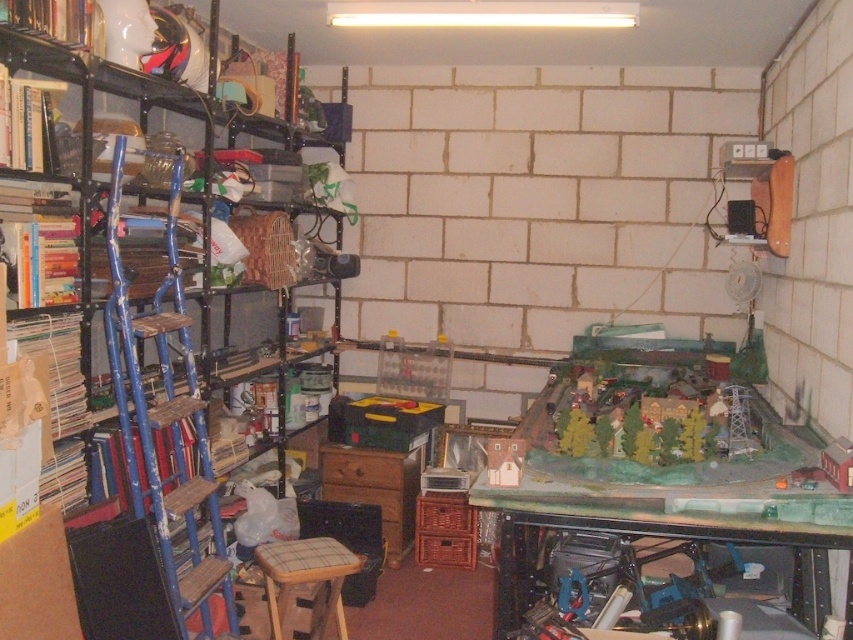
What do you see at coordinates (138, 396) in the screenshot? I see `metallic blue ladder at left` at bounding box center [138, 396].

Between metallic blue ladder at left and wooden stool at center, which one has more height?

With more height is metallic blue ladder at left.

What do you see at coordinates (138, 396) in the screenshot? This screenshot has height=640, width=853. I see `metallic blue ladder at left` at bounding box center [138, 396].

Locate an element on the screen. Image resolution: width=853 pixels, height=640 pixels. metallic blue ladder at left is located at coordinates (138, 396).

Who is taller, green matte table at center or metallic blue ladder at left?

metallic blue ladder at left

Is point (527, 513) closer to camera compared to point (115, 321)?

Yes.

Find the location of a particular element. The image size is (853, 640). green matte table at center is located at coordinates (664, 522).

Which is more to the right, green matte table at center or wooden stool at center?

Positioned to the right is green matte table at center.

Is green matte table at center to the left of wooden stool at center from the viewer's perspective?

In fact, green matte table at center is to the right of wooden stool at center.

Is point (624, 564) positioned after point (338, 598)?

Yes, it is.

Where is `green matte table at center`? The width and height of the screenshot is (853, 640). green matte table at center is located at coordinates (664, 522).